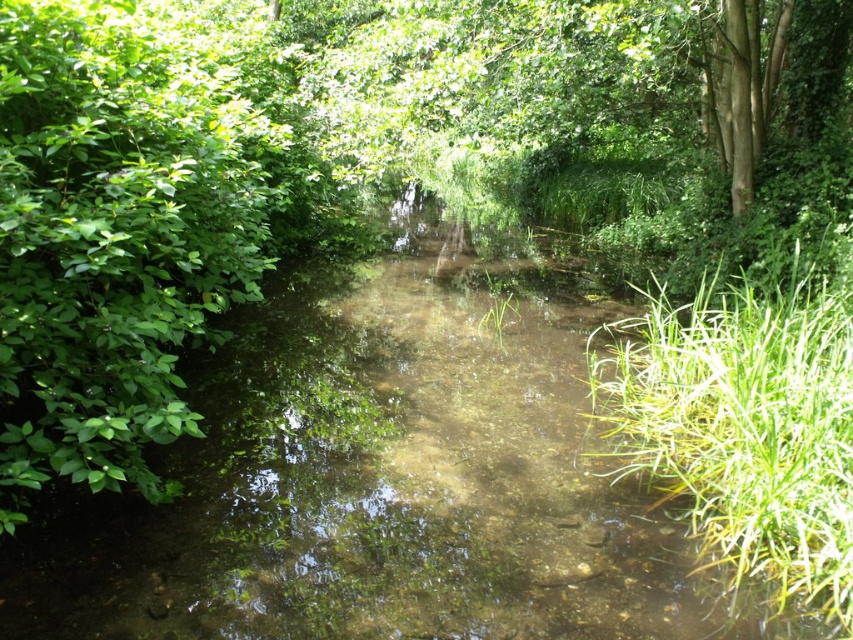
Does clear water stream at center have a smaller size compared to green grassy at right?

No, clear water stream at center is not smaller than green grassy at right.

Which is more to the left, clear water stream at center or green grassy at right?

From the viewer's perspective, clear water stream at center appears more on the left side.

Identify the location of clear water stream at center. The image size is (853, 640). (386, 472).